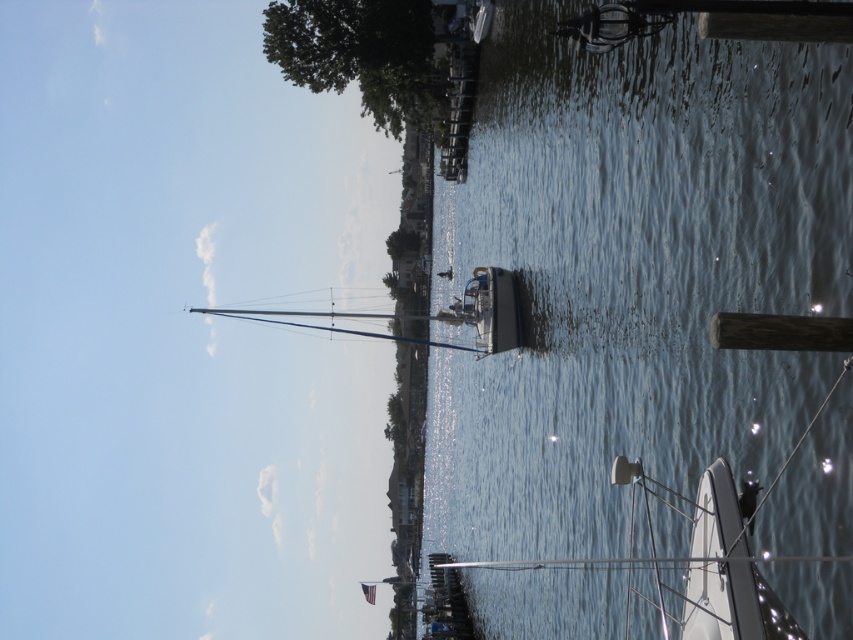
Image resolution: width=853 pixels, height=640 pixels. What do you see at coordinates (685, 568) in the screenshot? I see `white glossy sailboat at lower right` at bounding box center [685, 568].

Does white glossy sailboat at lower right have a greater width compared to green leafy tree at upper left?

No.

The height and width of the screenshot is (640, 853). Describe the element at coordinates (685, 568) in the screenshot. I see `white glossy sailboat at lower right` at that location.

Locate an element on the screen. white glossy sailboat at lower right is located at coordinates (685, 568).

Identify the location of clear water at center. (631, 273).

This screenshot has width=853, height=640. In order to click on clear water at center in this screenshot , I will do `click(631, 273)`.

Does point (761, 467) come farther from viewer compared to point (410, 38)?

No, it is in front of (410, 38).

Who is more forward, (x=793, y=220) or (x=364, y=90)?

Point (x=793, y=220)

Image resolution: width=853 pixels, height=640 pixels. Identify the location of clear water at center. (631, 273).